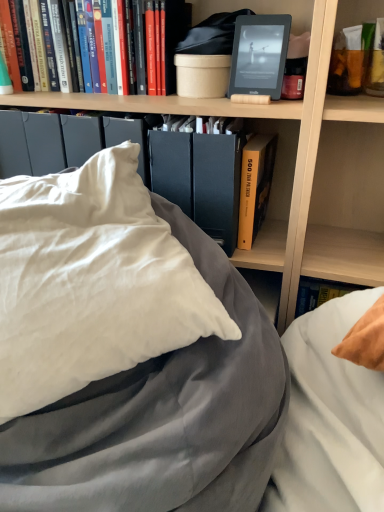
Question: Is matte black kindle at upper center, which is the 2th paperback book in bottom-to-top order, inside the boundaries of matte orange tube at upper right, which is the 3th book in left-to-right order, or outside?

Choices:
 (A) inside
 (B) outside

Answer: (B)

Question: Looking at their shapes, would you say matte black kindle at upper center, placed as the 1th paperback book when sorted from top to bottom, is wider or thinner than matte orange tube at upper right, marked as the second book in a bottom-to-top arrangement?

Choices:
 (A) wide
 (B) thin

Answer: (A)

Question: Which is farther from the matte orange tube at upper right, the first book in the right-to-left sequence?

Choices:
 (A) matte black kindle at upper center, which is the 2th paperback book in bottom-to-top order
 (B) hardcover book at upper left, the third book when ordered from bottom to top
 (C) yellow hardcover book at center, the 2th book from the right
 (D) white satin pillow at center
 (E) matte black folder at center, the 2th paperback book from the top

Answer: (D)

Question: Estimate the real-world distances between objects in this image. Which object is farther from the white satin pillow at center?

Choices:
 (A) wooden bookshelf at upper center
 (B) matte orange tube at upper right, which appears as the second book when viewed from the top
 (C) matte black folder at center, the 2th paperback book from the top
 (D) yellow hardcover book at center, the 3th book when ordered from top to bottom
 (E) hardcover book at upper left, which is counted as the first book, starting from the top

Answer: (B)